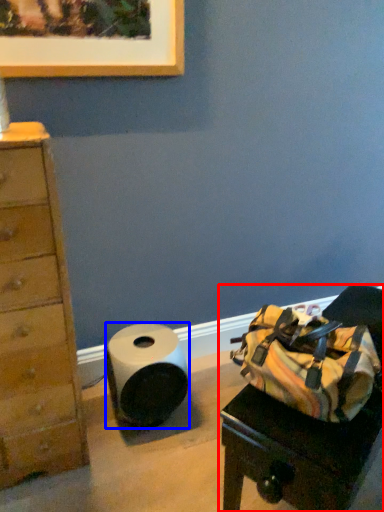
Question: Which point is closer to the camera, furniture (highlighted by a red box) or paper towel (highlighted by a blue box)?

Choices:
 (A) furniture
 (B) paper towel

Answer: (A)